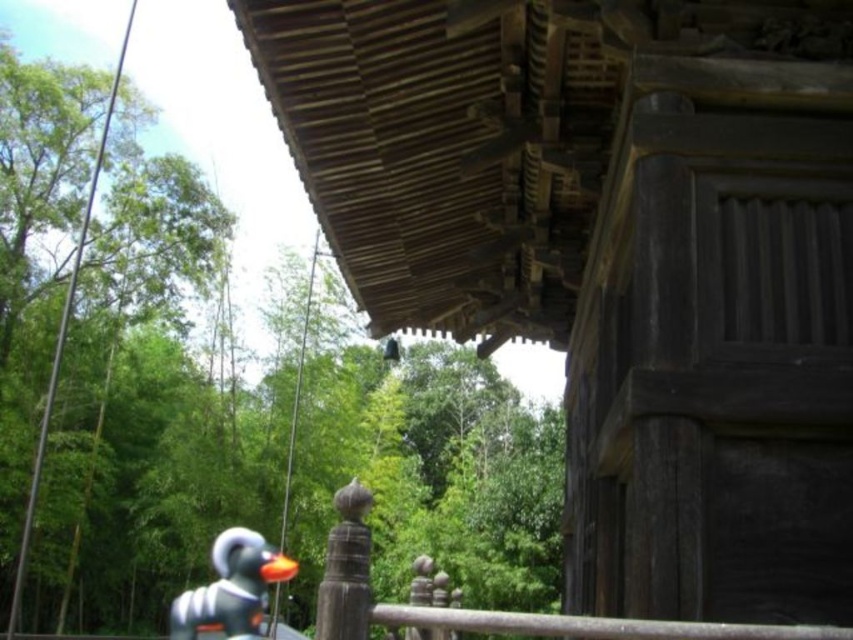
Which is more to the left, dark brown wood at upper right or white matte rubber duck at lower left?

white matte rubber duck at lower left

Does dark brown wood at upper right have a larger size compared to white matte rubber duck at lower left?

No, dark brown wood at upper right is not bigger than white matte rubber duck at lower left.

Is point (675, 300) positioned after point (277, 561)?

Yes, it is behind point (277, 561).

Identify the location of dark brown wood at upper right. (614, 257).